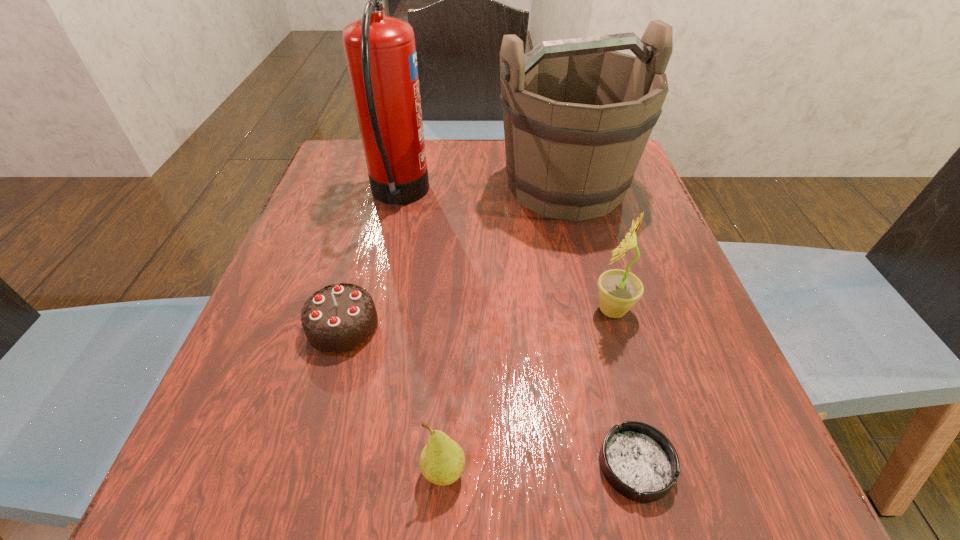
The width and height of the screenshot is (960, 540). What are the coordinates of `vacant area at the right edge of the desktop` in the screenshot? It's located at (667, 233).

In the image, there is a desktop. Where is `vacant region at the far left corner`? vacant region at the far left corner is located at coordinates (358, 165).

The height and width of the screenshot is (540, 960). I want to click on vacant area that lies between the fifth shortest object and the fourth tallest object, so click(505, 328).

Locate an element on the screen. This screenshot has height=540, width=960. vacant area between the fire extinguisher and the ashtray is located at coordinates (517, 330).

The height and width of the screenshot is (540, 960). In order to click on vacant area between the pear and the shortest object in this screenshot , I will do `click(540, 468)`.

You are a GUI agent. You are given a task and a screenshot of the screen. Output one action in this format:
    pyautogui.click(x=<x>, y=<y>)
    Task: Click on the free point between the bucket and the tallest object
    This screenshot has height=540, width=960.
    Given the screenshot: What is the action you would take?
    pyautogui.click(x=483, y=191)

You are a GUI agent. You are given a task and a screenshot of the screen. Output one action in this format:
    pyautogui.click(x=<x>, y=<y>)
    Task: Click on the vacant area that lies between the fourth object from right to left and the fire extinguisher
    This screenshot has width=960, height=540.
    Given the screenshot: What is the action you would take?
    pyautogui.click(x=421, y=334)

The image size is (960, 540). Identify the location of free space that is in between the third shortest object and the bucket. (505, 328).

Identify the location of vacant area between the bucket and the second shortest object. (454, 256).

The height and width of the screenshot is (540, 960). Identify the location of empty location between the fifth shortest object and the fire extinguisher. (483, 191).